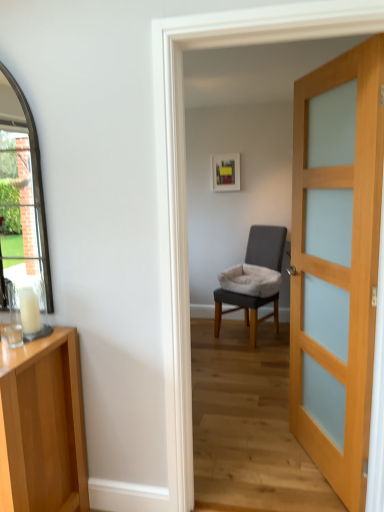
You are a GUI agent. You are given a task and a screenshot of the screen. Output one action in this format:
    pyautogui.click(x=<x>, y=<y>)
    Task: Click on the vacant space situated on the left part of gray fabric chair at center
    
    Given the screenshot: What is the action you would take?
    pyautogui.click(x=208, y=338)